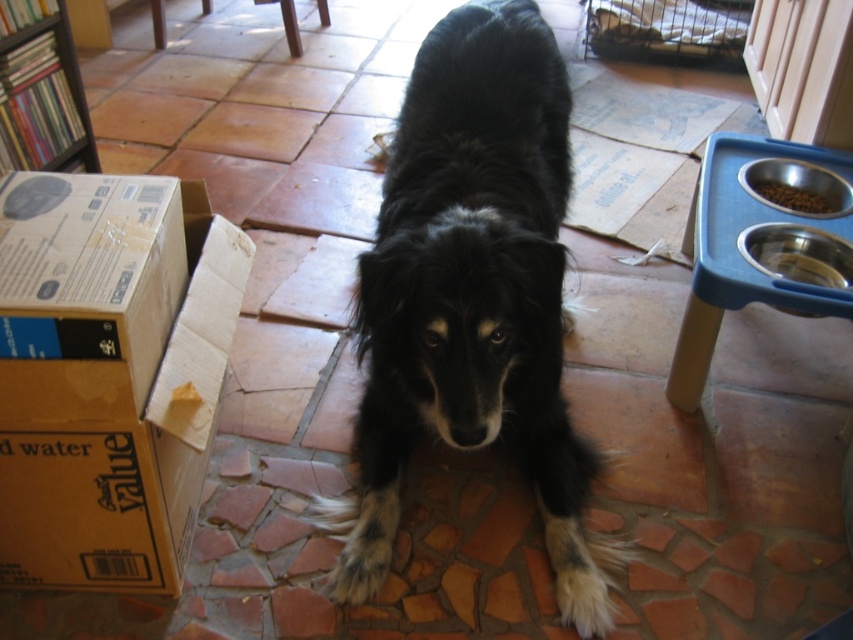
Question: Considering the relative positions of brown cardboard box at left and brown dry kibble at upper right in the image provided, where is brown cardboard box at left located with respect to brown dry kibble at upper right?

Choices:
 (A) right
 (B) left

Answer: (B)

Question: Among these objects, which one is farthest from the camera?

Choices:
 (A) wooden bookshelf at upper left
 (B) brown cardboard box at left
 (C) blue plastic pet feeder at right

Answer: (A)

Question: Among these objects, which one is farthest from the camera?

Choices:
 (A) brown dry kibble at upper right
 (B) black fur dog at center
 (C) blue plastic pet feeder at right
 (D) wooden bookshelf at upper left

Answer: (D)

Question: Does black fur dog at center appear under wooden bookshelf at upper left?

Choices:
 (A) no
 (B) yes

Answer: (B)

Question: Observing the image, what is the correct spatial positioning of brown cardboard box at left in reference to wooden bookshelf at upper left?

Choices:
 (A) right
 (B) left

Answer: (A)

Question: Which object appears closest to the camera in this image?

Choices:
 (A) brown dry kibble at upper right
 (B) wooden bookshelf at upper left
 (C) blue plastic pet feeder at right
 (D) brown cardboard box at left

Answer: (D)